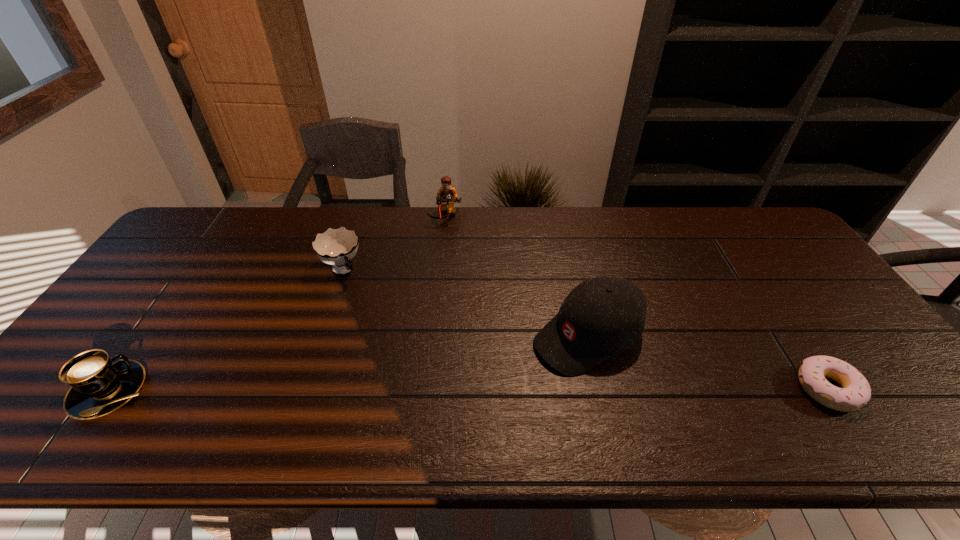
The width and height of the screenshot is (960, 540). I want to click on vacant region located holding a crossbow in the hands of the third object from left to right, so click(x=455, y=273).

The image size is (960, 540). Identify the location of free space located 0.370m holding a crossbow in the hands of the third object from left to right. (462, 306).

Where is `vacant region located holding a crossbow in the hands of the third object from left to right`? The image size is (960, 540). vacant region located holding a crossbow in the hands of the third object from left to right is located at coordinates (449, 238).

Image resolution: width=960 pixels, height=540 pixels. What are the coordinates of `vacant space located on the side of the second farthest object with the handle` in the screenshot? It's located at (363, 299).

Locate an element on the screen. This screenshot has height=540, width=960. vacant space positioned on the side of the second farthest object with the handle is located at coordinates (402, 349).

In order to click on free region located on the side of the second farthest object with the handle in this screenshot , I will do `click(400, 346)`.

This screenshot has height=540, width=960. Identify the location of free space located 0.210m with a logo on the front of the fourth object from left to right. (471, 397).

Locate an element on the screen. Image resolution: width=960 pixels, height=540 pixels. vacant space located 0.100m with a logo on the front of the fourth object from left to right is located at coordinates (511, 375).

Where is `free point located 0.120m with a logo on the front of the fourth object from left to right`? The width and height of the screenshot is (960, 540). free point located 0.120m with a logo on the front of the fourth object from left to right is located at coordinates (503, 379).

Where is `object that is at the far edge`? The image size is (960, 540). object that is at the far edge is located at coordinates point(447,195).